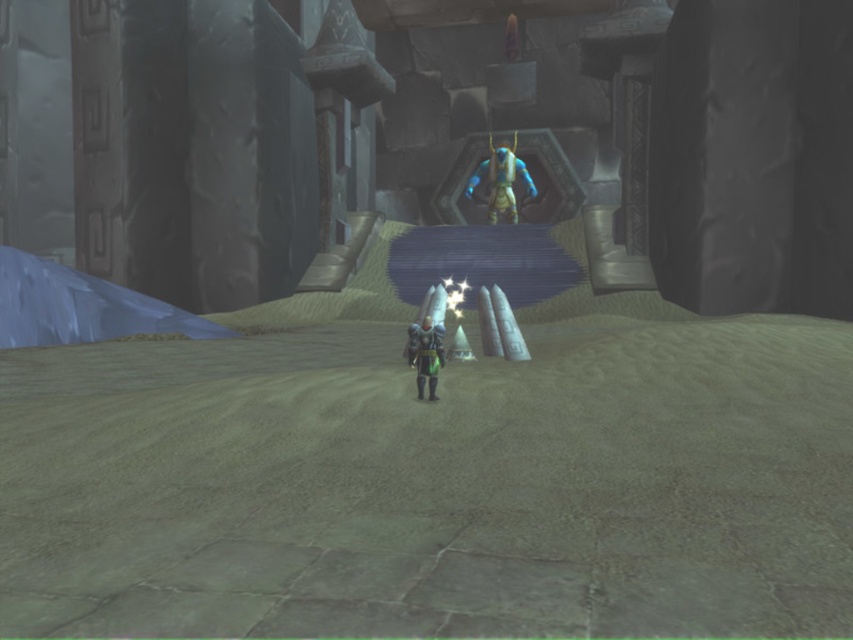
Can you confirm if blue metallic armor at center is bigger than shiny metallic armor at center?

Indeed, blue metallic armor at center has a larger size compared to shiny metallic armor at center.

Measure the distance from blue metallic armor at center to shiny metallic armor at center.

blue metallic armor at center and shiny metallic armor at center are 9.69 meters apart from each other.

This screenshot has width=853, height=640. I want to click on blue metallic armor at center, so click(x=502, y=182).

What are the coordinates of `blue metallic armor at center` in the screenshot? It's located at (502, 182).